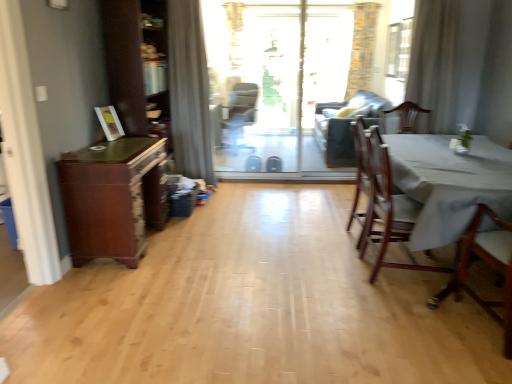
Question: Is gray fabric curtain at upper center, positioned as the first curtain in left-to-right order, at the right side of white sheer curtain at upper right, which ranks as the 1th curtain in right-to-left order?

Choices:
 (A) yes
 (B) no

Answer: (B)

Question: Considering the relative sizes of gray fabric curtain at upper center, positioned as the first curtain in left-to-right order, and white sheer curtain at upper right, which is counted as the 2th curtain, starting from the left, in the image provided, is gray fabric curtain at upper center, positioned as the first curtain in left-to-right order, wider than white sheer curtain at upper right, which is counted as the 2th curtain, starting from the left,?

Choices:
 (A) no
 (B) yes

Answer: (B)

Question: From the image's perspective, does gray fabric curtain at upper center, acting as the 2th curtain starting from the right, appear higher than white sheer curtain at upper right, which ranks as the 1th curtain in right-to-left order?

Choices:
 (A) no
 (B) yes

Answer: (A)

Question: From a real-world perspective, is gray fabric curtain at upper center, acting as the 2th curtain starting from the right, located higher than white sheer curtain at upper right, which ranks as the 1th curtain in right-to-left order?

Choices:
 (A) no
 (B) yes

Answer: (A)

Question: Does gray fabric curtain at upper center, acting as the 2th curtain starting from the right, come behind white sheer curtain at upper right, which ranks as the 1th curtain in right-to-left order?

Choices:
 (A) yes
 (B) no

Answer: (A)

Question: Looking at their shapes, would you say mahogany wood chair at right, the first chair in the back-to-front sequence, is wider or thinner than transparent glass screen door at center?

Choices:
 (A) thin
 (B) wide

Answer: (B)

Question: From a real-world perspective, is mahogany wood chair at right, arranged as the 3th chair when viewed from the front, positioned above or below transparent glass screen door at center?

Choices:
 (A) above
 (B) below

Answer: (B)

Question: Which is correct: mahogany wood chair at right, the first chair in the back-to-front sequence, is inside transparent glass screen door at center, or outside of it?

Choices:
 (A) inside
 (B) outside

Answer: (B)

Question: Considering the relative positions of mahogany wood chair at right, arranged as the 3th chair when viewed from the front, and transparent glass screen door at center in the image provided, is mahogany wood chair at right, arranged as the 3th chair when viewed from the front, to the left or to the right of transparent glass screen door at center?

Choices:
 (A) left
 (B) right

Answer: (B)

Question: From a real-world perspective, is brown wood dresser at left positioned above or below transparent glass window screen at upper right?

Choices:
 (A) above
 (B) below

Answer: (B)

Question: Considering the positions of brown wood dresser at left and transparent glass window screen at upper right in the image, is brown wood dresser at left bigger or smaller than transparent glass window screen at upper right?

Choices:
 (A) big
 (B) small

Answer: (A)

Question: Is point (153, 21) positioned closer to the camera than point (399, 67)?

Choices:
 (A) closer
 (B) farther

Answer: (A)

Question: In the image, is brown wood dresser at left positioned in front of or behind transparent glass window screen at upper right?

Choices:
 (A) front
 (B) behind

Answer: (A)

Question: Is gray fabric curtain at upper center, acting as the 2th curtain starting from the right, wider or thinner than wooden chair at right, the 2th chair from the front?

Choices:
 (A) wide
 (B) thin

Answer: (B)

Question: Considering their positions, is gray fabric curtain at upper center, acting as the 2th curtain starting from the right, located in front of or behind wooden chair at right, the second chair when ordered from back to front?

Choices:
 (A) behind
 (B) front

Answer: (A)